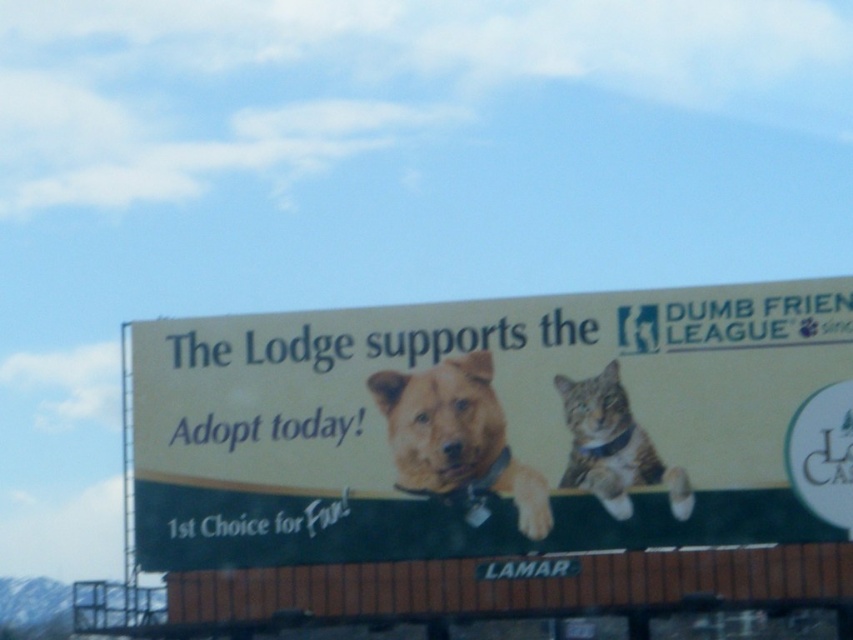
Question: Which point is farther from the camera taking this photo?

Choices:
 (A) (480, 506)
 (B) (610, 492)

Answer: (A)

Question: Can you confirm if white paper billboard at center is positioned to the left of brown fur dog at center?

Choices:
 (A) no
 (B) yes

Answer: (A)

Question: Among these objects, which one is farthest from the camera?

Choices:
 (A) white paper billboard at center
 (B) tabby fur cat at center
 (C) brown fur dog at center

Answer: (C)

Question: Does brown fur dog at center have a greater width compared to tabby fur cat at center?

Choices:
 (A) yes
 (B) no

Answer: (B)

Question: Based on their relative distances, which object is nearer to the white paper billboard at center?

Choices:
 (A) tabby fur cat at center
 (B) brown fur dog at center

Answer: (B)

Question: From the image, what is the correct spatial relationship of white paper billboard at center in relation to brown fur dog at center?

Choices:
 (A) left
 (B) right

Answer: (B)